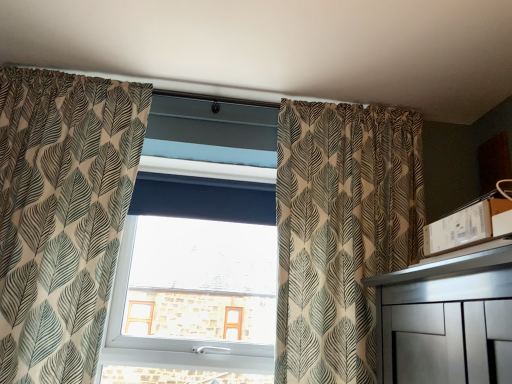
Question: From a real-world perspective, is patterned fabric curtain at left, which ranks as the 1th curtain in left-to-right order, located higher than patterned fabric curtain at center, which is the second curtain from left to right?

Choices:
 (A) yes
 (B) no

Answer: (B)

Question: Is patterned fabric curtain at left, which ranks as the 1th curtain in left-to-right order, looking in the opposite direction of patterned fabric curtain at center, which is the second curtain from left to right?

Choices:
 (A) no
 (B) yes

Answer: (A)

Question: Is patterned fabric curtain at left, acting as the 2th curtain starting from the right, directly adjacent to patterned fabric curtain at center, acting as the first curtain starting from the right?

Choices:
 (A) no
 (B) yes

Answer: (A)

Question: Can you confirm if patterned fabric curtain at left, acting as the 2th curtain starting from the right, is taller than patterned fabric curtain at center, acting as the first curtain starting from the right?

Choices:
 (A) no
 (B) yes

Answer: (B)

Question: Considering the relative sizes of patterned fabric curtain at left, which ranks as the 1th curtain in left-to-right order, and patterned fabric curtain at center, acting as the first curtain starting from the right, in the image provided, is patterned fabric curtain at left, which ranks as the 1th curtain in left-to-right order, shorter than patterned fabric curtain at center, acting as the first curtain starting from the right,?

Choices:
 (A) yes
 (B) no

Answer: (B)

Question: Considering the positions of point (348, 365) and point (34, 258), is point (348, 365) closer or farther from the camera than point (34, 258)?

Choices:
 (A) farther
 (B) closer

Answer: (A)

Question: In terms of width, does patterned fabric curtain at center, which is the second curtain from left to right, look wider or thinner when compared to patterned fabric curtain at left, which ranks as the 1th curtain in left-to-right order?

Choices:
 (A) thin
 (B) wide

Answer: (B)

Question: In terms of height, does patterned fabric curtain at center, acting as the first curtain starting from the right, look taller or shorter compared to patterned fabric curtain at left, acting as the 2th curtain starting from the right?

Choices:
 (A) tall
 (B) short

Answer: (B)

Question: Considering their positions, is patterned fabric curtain at center, which is the second curtain from left to right, located in front of or behind patterned fabric curtain at left, acting as the 2th curtain starting from the right?

Choices:
 (A) behind
 (B) front

Answer: (A)

Question: In terms of height, does patterned fabric curtain at left, which ranks as the 1th curtain in left-to-right order, look taller or shorter compared to patterned fabric curtain at center, acting as the first curtain starting from the right?

Choices:
 (A) tall
 (B) short

Answer: (A)

Question: From the image's perspective, is patterned fabric curtain at left, which ranks as the 1th curtain in left-to-right order, above or below patterned fabric curtain at center, acting as the first curtain starting from the right?

Choices:
 (A) above
 (B) below

Answer: (A)

Question: Does point (53, 196) appear closer or farther from the camera than point (415, 182)?

Choices:
 (A) closer
 (B) farther

Answer: (A)

Question: Do you think patterned fabric curtain at left, which ranks as the 1th curtain in left-to-right order, is within patterned fabric curtain at center, acting as the first curtain starting from the right, or outside of it?

Choices:
 (A) outside
 (B) inside

Answer: (A)

Question: Based on their positions, is transparent glass window at center located to the left or right of patterned fabric curtain at left, which ranks as the 1th curtain in left-to-right order?

Choices:
 (A) right
 (B) left

Answer: (A)

Question: Considering their positions, is transparent glass window at center located in front of or behind patterned fabric curtain at left, which ranks as the 1th curtain in left-to-right order?

Choices:
 (A) front
 (B) behind

Answer: (B)